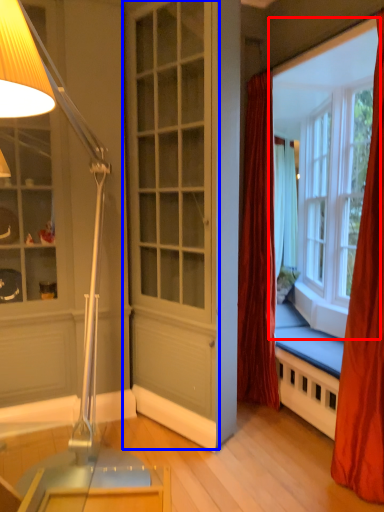
Question: Which object is further to the camera taking this photo, window (highlighted by a red box) or screen door (highlighted by a blue box)?

Choices:
 (A) window
 (B) screen door

Answer: (A)